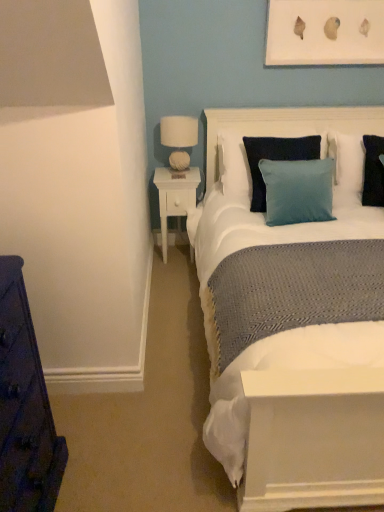
Question: From the image's perspective, is white fabric headboard at upper center above black matte pillow at right, the second pillow when ordered from back to front?

Choices:
 (A) no
 (B) yes

Answer: (B)

Question: Is white fabric headboard at upper center behind black matte pillow at right, placed as the first pillow when sorted from front to back?

Choices:
 (A) no
 (B) yes

Answer: (B)

Question: Is white fabric headboard at upper center thinner than black matte pillow at right, the second pillow when ordered from back to front?

Choices:
 (A) no
 (B) yes

Answer: (B)

Question: Is white fabric headboard at upper center beside black matte pillow at right, the second pillow when ordered from back to front?

Choices:
 (A) no
 (B) yes

Answer: (A)

Question: Does white fabric headboard at upper center turn towards black matte pillow at right, placed as the first pillow when sorted from front to back?

Choices:
 (A) no
 (B) yes

Answer: (A)

Question: Is white fabric headboard at upper center not near black matte pillow at right, placed as the first pillow when sorted from front to back?

Choices:
 (A) no
 (B) yes

Answer: (A)

Question: Does white wood nightstand at center-left come behind white fabric headboard at upper center?

Choices:
 (A) no
 (B) yes

Answer: (B)

Question: Can white fabric headboard at upper center be found inside white wood nightstand at center-left?

Choices:
 (A) no
 (B) yes

Answer: (A)

Question: Is white wood nightstand at center-left not inside white fabric headboard at upper center?

Choices:
 (A) yes
 (B) no

Answer: (A)

Question: Does white wood nightstand at center-left have a larger size compared to white fabric headboard at upper center?

Choices:
 (A) no
 (B) yes

Answer: (A)

Question: Does white wood nightstand at center-left have a greater height compared to white fabric headboard at upper center?

Choices:
 (A) yes
 (B) no

Answer: (A)

Question: From a real-world perspective, does white wood nightstand at center-left stand above white fabric headboard at upper center?

Choices:
 (A) yes
 (B) no

Answer: (B)

Question: Is white fabric lampshade at upper right oriented towards black matte pillow at right, placed as the first pillow when sorted from front to back?

Choices:
 (A) no
 (B) yes

Answer: (A)